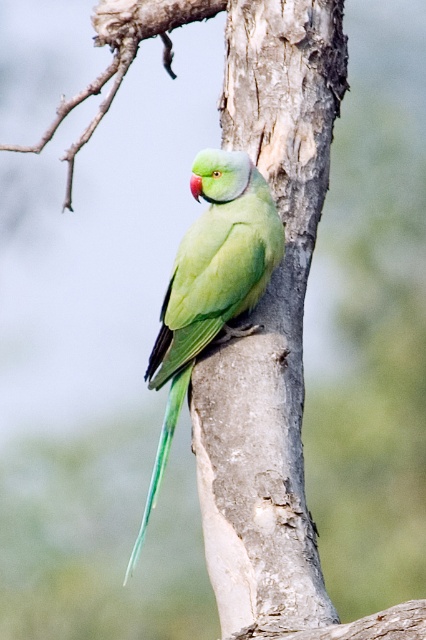
Looking at this image, you are an ornithologist observing the green matte parrot at center and the smooth bark tree trunk at center. Which object would cast a larger shadow when the sun is directly overhead?

The smooth bark tree trunk at center is larger in size than the green matte parrot at center, so it would cast a larger shadow when the sun is directly overhead.

You are a birdwatcher observing the green matte parrot at center and the smooth bark tree branch at upper center in the image. Which object is positioned to the left?

The smooth bark tree branch at upper center is positioned to the left of the green matte parrot at center.